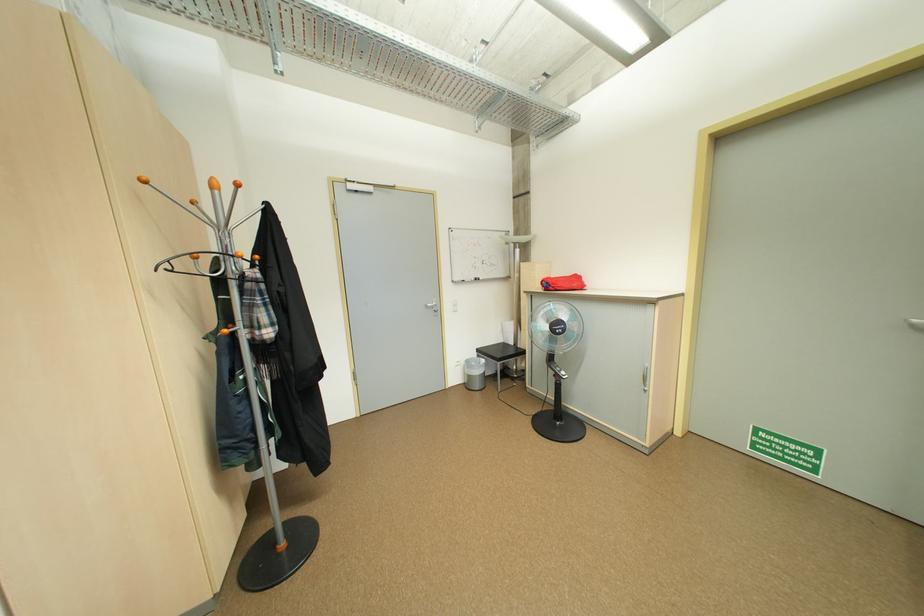
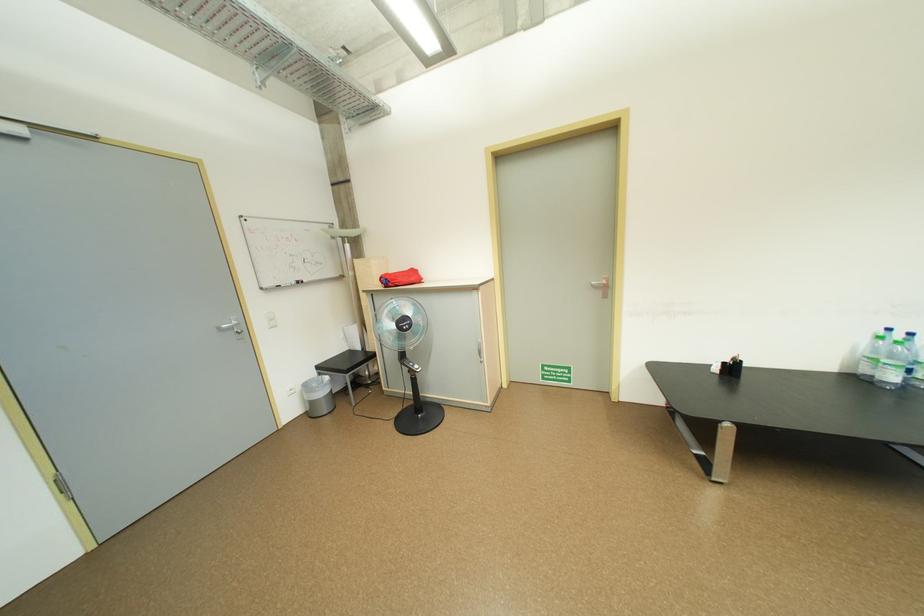
Question: How did the camera likely rotate?

Choices:
 (A) Left
 (B) Right
 (C) Up
 (D) Down

Answer: (B)